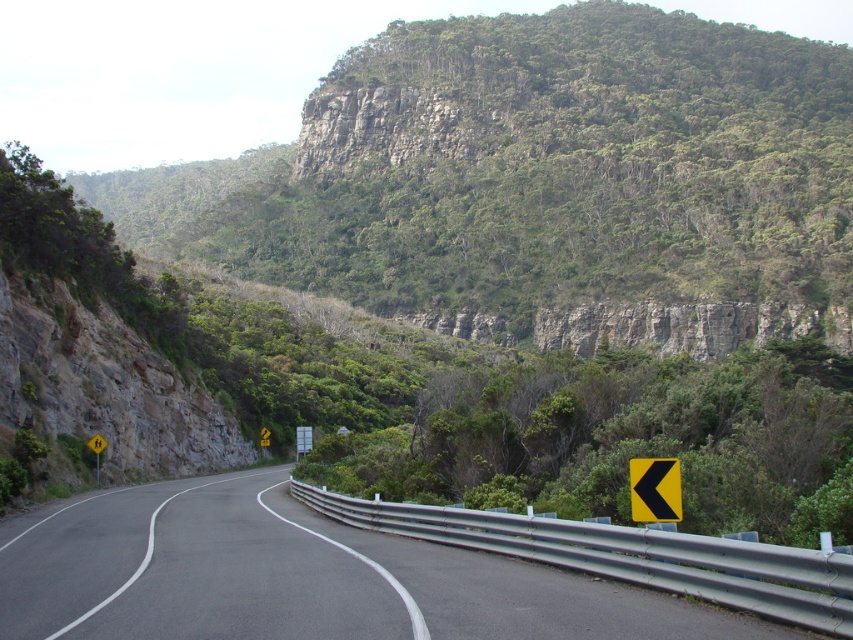
You are driving a car with a width of 2 meters. You need to pass through the space between the black asphalt road at center and the yellow reflective plastic at right. Can your car fit through this space?

The distance between the black asphalt road at center and the yellow reflective plastic at right is 6.42 meters. Since your car is only 2 meters wide, it can easily fit through the space as the available width is more than sufficient.

You are navigating a vehicle along the black asphalt road at center. To ensure safety, you need to stay within the road boundaries. Based on the scene description, which side of the road has a guardrail and which side has the warning signs?

The metal guardrail is on the right side of the black asphalt road at center, while the yellow warning signs are on the left side of the road.